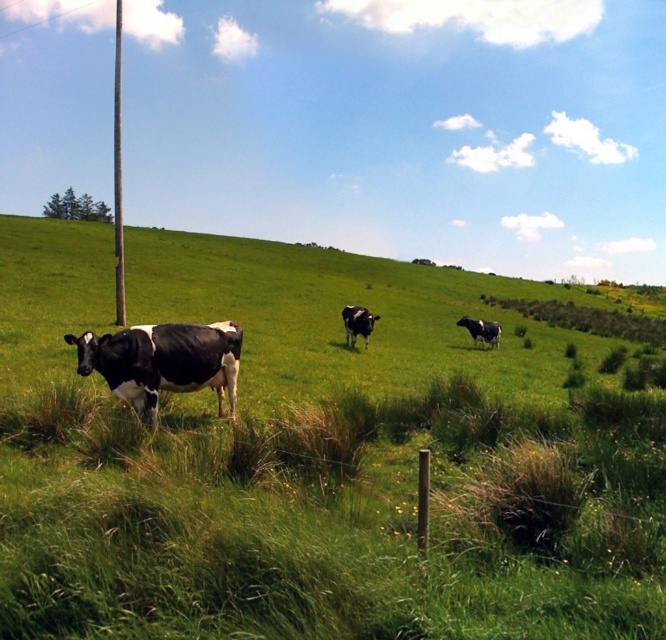
You are a farmer checking the field. You see the black and white cow at left and the metallic gray pole at left. Which object is closer to you?

The black and white cow at left is closer to you because it has a smaller size compared to the metallic gray pole at left, indicating it is nearer due to perspective.

You are a photographer trying to capture a photo of both the black and white cow at left and the black glossy cow at center. From your current position, can you see both cows in your camera frame at the same time?

Yes, you can see both the black and white cow at left and the black glossy cow at center in your camera frame at the same time because the black and white cow at left is in front of the black glossy cow at center, so they are not blocked from view.